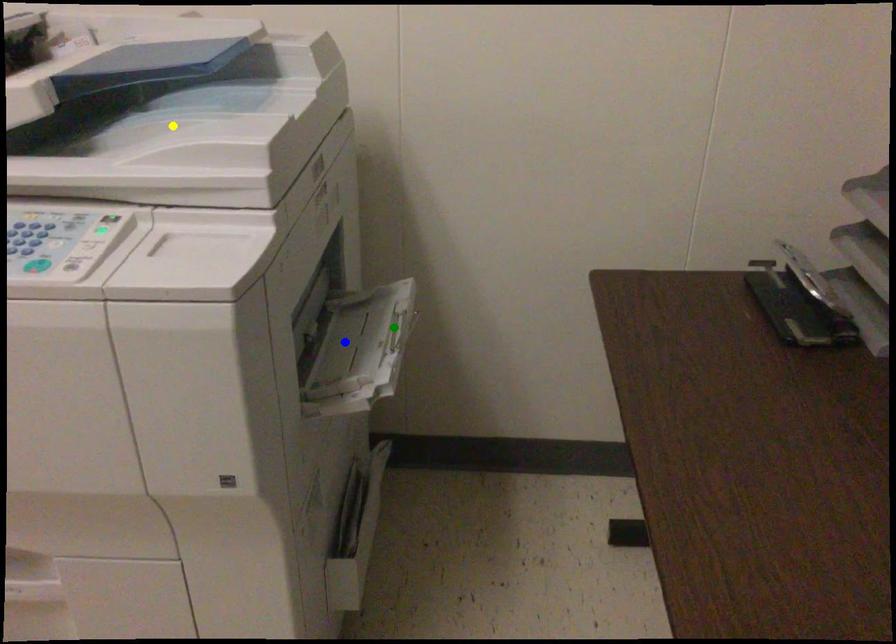
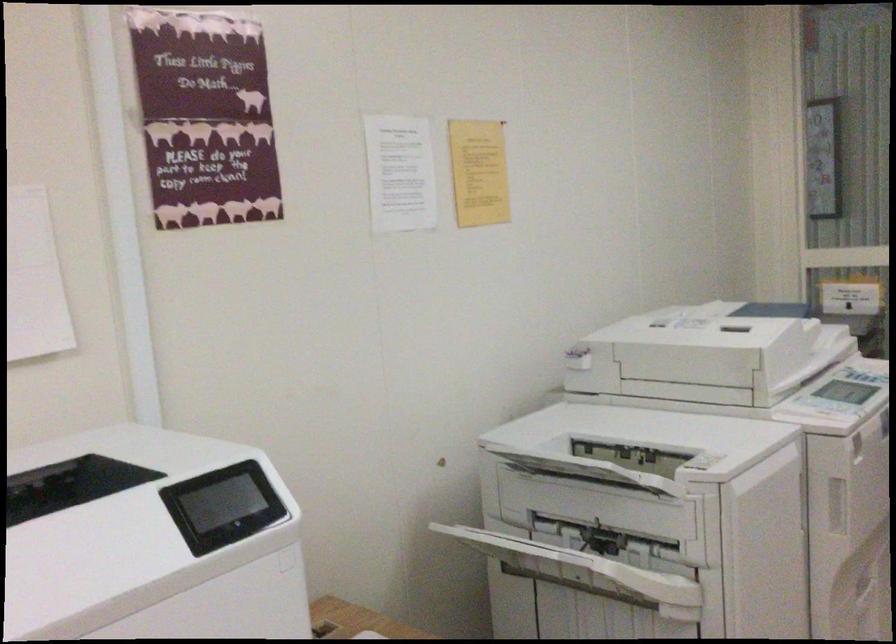
I am providing you with two images of the same scene from different viewpoints. Three points are marked in image1. Which point corresponds to a part or object that is occluded in image2?In image1, three points are marked. Which of them correspond to a part or object that is occluded in image2?Among the three points shown in image1, which one corresponds to a part or object that is no longer visible due to occlusion in image2?

Invisible in image2: green point, yellow point, blue point.